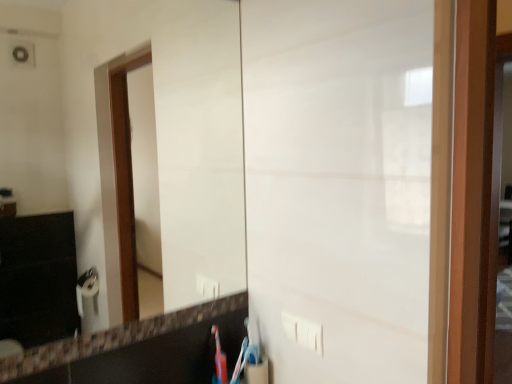
Question: Is white glossy mirror at center oriented towards white plastic electric outlet at lower center?

Choices:
 (A) yes
 (B) no

Answer: (A)

Question: Is white glossy mirror at center shorter than white plastic electric outlet at lower center?

Choices:
 (A) yes
 (B) no

Answer: (B)

Question: From a real-world perspective, is white glossy mirror at center physically below white plastic electric outlet at lower center?

Choices:
 (A) yes
 (B) no

Answer: (B)

Question: Considering the relative sizes of white glossy mirror at center and white plastic electric outlet at lower center in the image provided, is white glossy mirror at center bigger than white plastic electric outlet at lower center?

Choices:
 (A) yes
 (B) no

Answer: (A)

Question: Is white glossy mirror at center to the left of white plastic electric outlet at lower center from the viewer's perspective?

Choices:
 (A) yes
 (B) no

Answer: (A)

Question: Are white glossy mirror at center and white plastic electric outlet at lower center located far from each other?

Choices:
 (A) yes
 (B) no

Answer: (A)

Question: From the image's perspective, does white glossy mirror at center appear lower than blue plastic toothbrush at lower center?

Choices:
 (A) no
 (B) yes

Answer: (A)

Question: Is white glossy mirror at center wider than blue plastic toothbrush at lower center?

Choices:
 (A) no
 (B) yes

Answer: (A)

Question: Could you tell me if white glossy mirror at center is turned towards blue plastic toothbrush at lower center?

Choices:
 (A) yes
 (B) no

Answer: (B)

Question: Is white glossy mirror at center turned away from blue plastic toothbrush at lower center?

Choices:
 (A) no
 (B) yes

Answer: (A)

Question: Is the surface of white glossy mirror at center in direct contact with blue plastic toothbrush at lower center?

Choices:
 (A) yes
 (B) no

Answer: (B)

Question: Is white glossy mirror at center thinner than blue plastic toothbrush at lower center?

Choices:
 (A) yes
 (B) no

Answer: (A)

Question: From a real-world perspective, is blue plastic toothbrush at lower center physically below white plastic electric outlet at lower center?

Choices:
 (A) no
 (B) yes

Answer: (B)